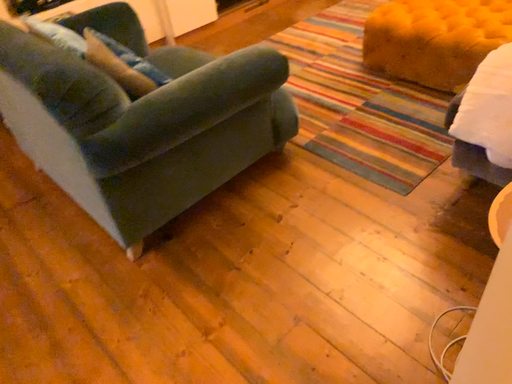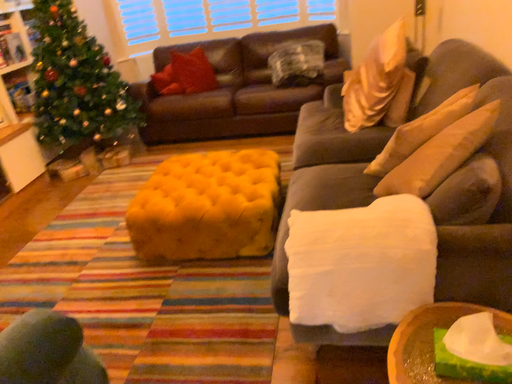
Question: Which way did the camera rotate in the video?

Choices:
 (A) rotated right
 (B) rotated left

Answer: (A)